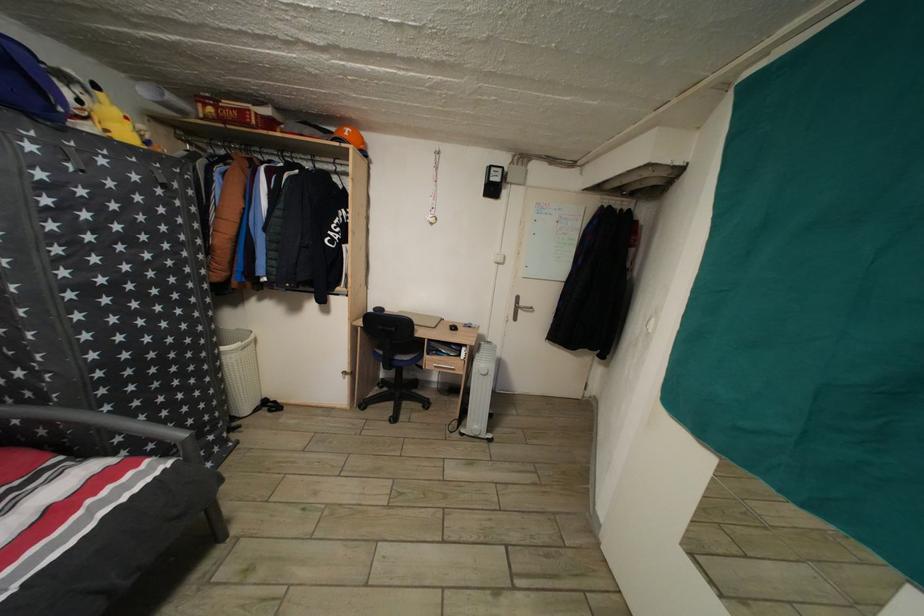
What do you see at coordinates (1, 1) in the screenshot?
I see `the grey sofa armrest` at bounding box center [1, 1].